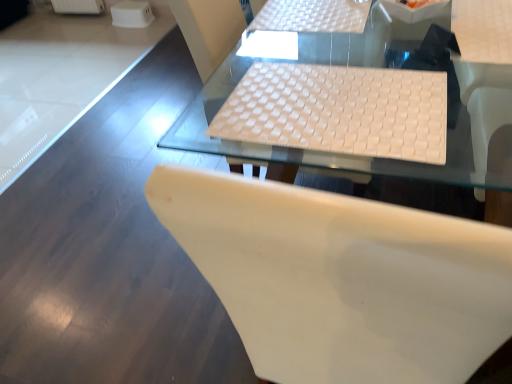
The width and height of the screenshot is (512, 384). Find the location of `free spot below white woven fabric laptop keyboard at center (from a real-world perspective)`. free spot below white woven fabric laptop keyboard at center (from a real-world perspective) is located at coordinates (325, 92).